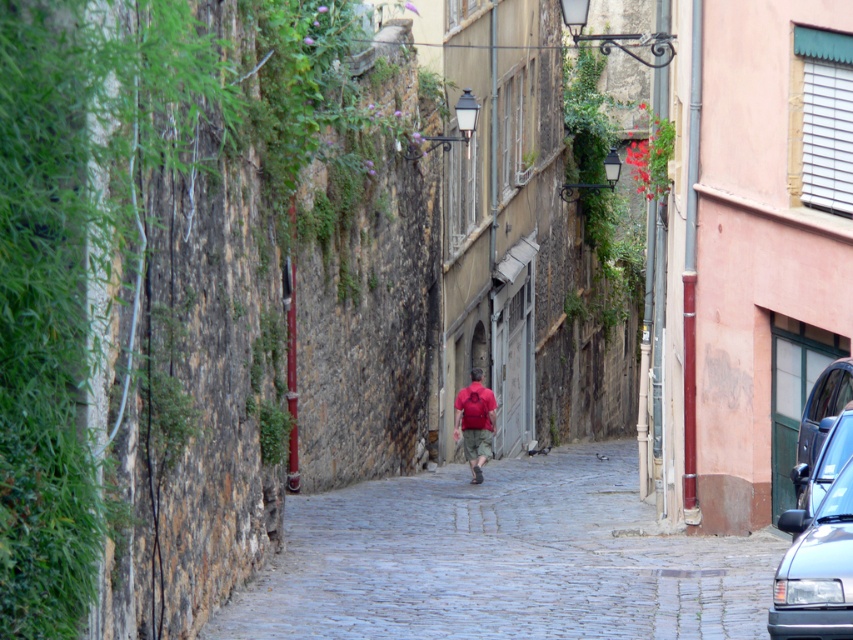
Question: Is cobblestone path at center positioned in front of red fabric shirt at center?

Choices:
 (A) yes
 (B) no

Answer: (A)

Question: Is black glossy car at lower right below red fabric shirt at center?

Choices:
 (A) yes
 (B) no

Answer: (A)

Question: In this image, where is black glossy car at lower right located relative to red fabric shirt at center?

Choices:
 (A) above
 (B) below

Answer: (B)

Question: Which point appears farthest from the camera in this image?

Choices:
 (A) (492, 426)
 (B) (421, 492)
 (C) (836, 362)
 (D) (784, 531)

Answer: (A)

Question: Which of the following is the farthest from the observer?

Choices:
 (A) black glossy car at lower right
 (B) red fabric shirt at center
 (C) cobblestone path at center

Answer: (B)

Question: Which point is closer to the camera?

Choices:
 (A) (482, 445)
 (B) (654, 547)
 (C) (846, 506)
 (D) (846, 376)

Answer: (C)